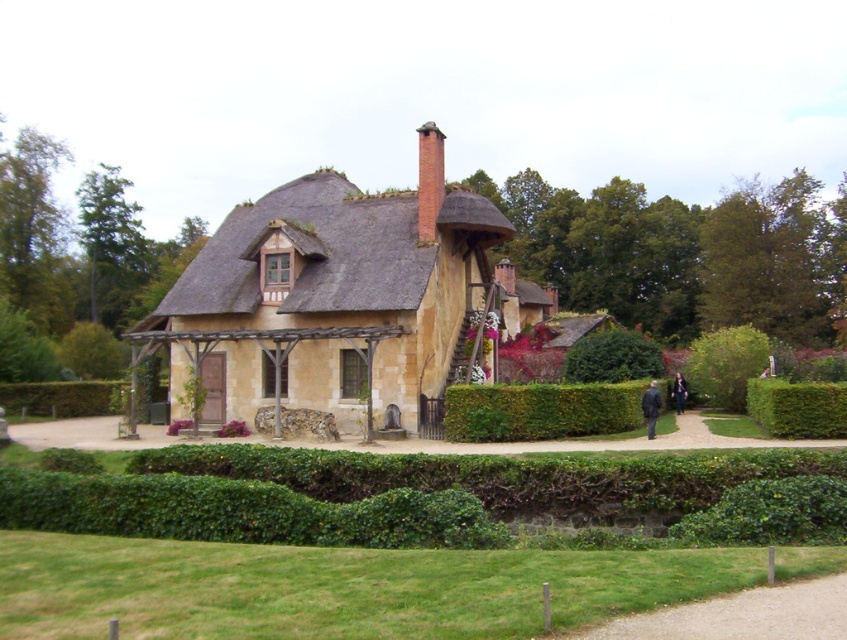
Which is below, beige stone cottage at center or green leafy bush at lower left?

Positioned lower is green leafy bush at lower left.

You are a GUI agent. You are given a task and a screenshot of the screen. Output one action in this format:
    pyautogui.click(x=<x>, y=<y>)
    Task: Click on the beige stone cottage at center
    The width and height of the screenshot is (847, 640).
    Given the screenshot: What is the action you would take?
    pyautogui.click(x=331, y=301)

Does point (280, 344) come in front of point (76, 330)?

Yes, it is in front of point (76, 330).

This screenshot has height=640, width=847. I want to click on beige stone cottage at center, so click(331, 301).

Who is taller, green leafy bush at right or dark blue fabric coat at lower right?

Standing taller between the two is green leafy bush at right.

Which is behind, point (738, 388) or point (649, 424)?

The point (738, 388) is more distant.

At what (x,y) coordinates should I click in order to perform the action: click on green leafy bush at right. Please return your answer as a coordinate pair (x, y). This screenshot has width=847, height=640. Looking at the image, I should click on (726, 364).

Does beige stone cottage at center have a lesser width compared to green leafy bush at center?

No.

Which is more to the left, beige stone cottage at center or green leafy bush at center?

From the viewer's perspective, beige stone cottage at center appears more on the left side.

This screenshot has height=640, width=847. What do you see at coordinates (331, 301) in the screenshot?
I see `beige stone cottage at center` at bounding box center [331, 301].

At what (x,y) coordinates should I click in order to perform the action: click on beige stone cottage at center. Please return your answer as a coordinate pair (x, y). The image size is (847, 640). Looking at the image, I should click on (331, 301).